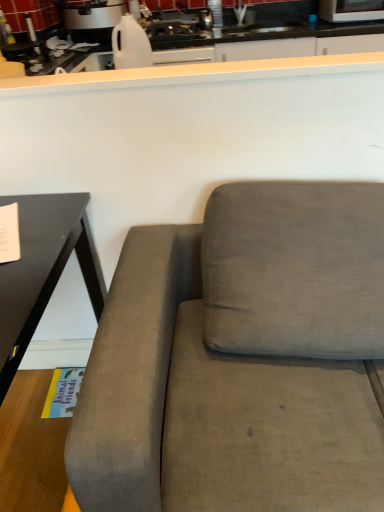
Question: Considering their positions, is matte gray couch at center located in front of or behind white smooth countertop at upper center?

Choices:
 (A) behind
 (B) front

Answer: (B)

Question: Considering the positions of point (94, 367) and point (266, 76), is point (94, 367) closer or farther from the camera than point (266, 76)?

Choices:
 (A) farther
 (B) closer

Answer: (B)

Question: Estimate the real-world distances between objects in this image. Which object is closer to the matte black table at left?

Choices:
 (A) matte gray couch at center
 (B) white smooth countertop at upper center
 (C) metallic silver microwave at upper right, the 2th appliance in the left-to-right sequence
 (D) white glossy rice cooker at upper left, marked as the 1th appliance in a left-to-right arrangement

Answer: (A)

Question: Which is farther from the matte black table at left?

Choices:
 (A) white glossy rice cooker at upper left, acting as the second appliance starting from the right
 (B) matte gray couch at center
 (C) metallic silver microwave at upper right, which is counted as the first appliance, starting from the right
 (D) white smooth countertop at upper center

Answer: (C)